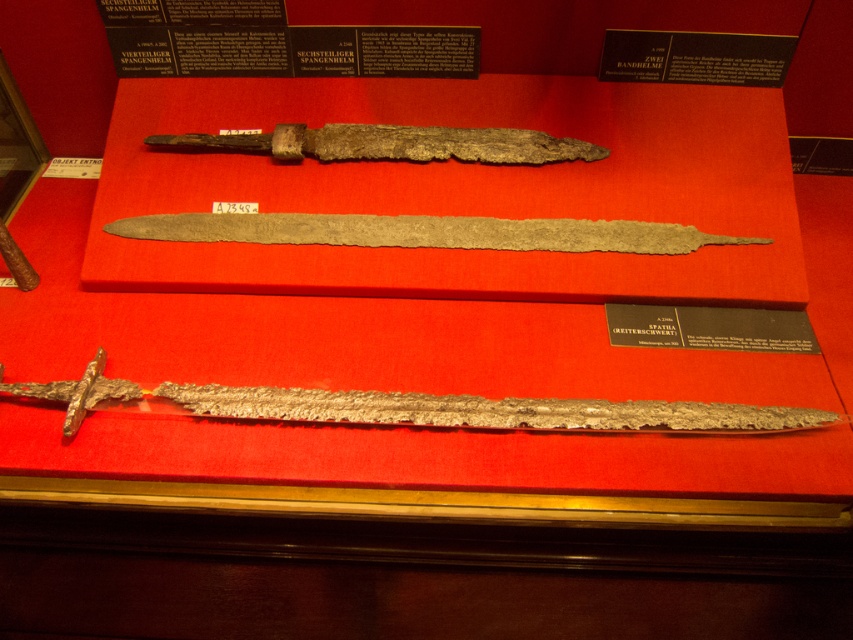
Question: Can you confirm if rusty metal dagger at center is bigger than silver metallic dagger at center?

Choices:
 (A) no
 (B) yes

Answer: (B)

Question: Considering the real-world distances, which object is closest to the silver metallic dagger at center?

Choices:
 (A) rusty metal dagger at center
 (B) rusty metal sword at center

Answer: (B)

Question: Which object is farther from the camera taking this photo?

Choices:
 (A) rusty metal dagger at center
 (B) silver metallic dagger at center
 (C) rusty metal sword at center

Answer: (C)

Question: Based on their relative distances, which object is farther from the rusty metal dagger at center?

Choices:
 (A) silver metallic dagger at center
 (B) rusty metal sword at center

Answer: (B)

Question: Is rusty metal dagger at center closer to the viewer compared to rusty metal sword at center?

Choices:
 (A) yes
 (B) no

Answer: (A)

Question: In this image, where is silver metallic dagger at center located relative to rusty metal sword at center?

Choices:
 (A) below
 (B) above

Answer: (A)